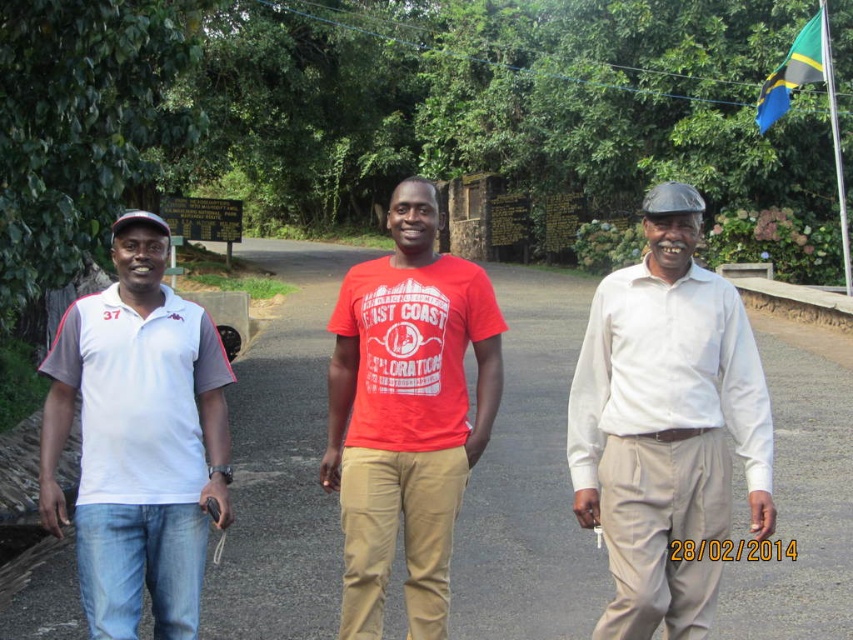
Consider the image. Is the position of khaki cotton pants at right less distant than that of matte khaki pants at center?

Yes, it is.

Who is more distant from viewer, (x=608, y=442) or (x=426, y=202)?

Positioned behind is point (x=426, y=202).

Where is `khaki cotton pants at right`? This screenshot has width=853, height=640. khaki cotton pants at right is located at coordinates (666, 424).

Does white cotton polo shirt at left appear under matte khaki pants at center?

Incorrect, white cotton polo shirt at left is not positioned below matte khaki pants at center.

Does point (148, 525) come behind point (457, 404)?

That is False.

Measure the distance between white cotton polo shirt at left and camera.

A distance of 12.28 feet exists between white cotton polo shirt at left and camera.

Identify the location of white cotton polo shirt at left. (138, 440).

Does khaki cotton pants at right have a larger size compared to white cotton polo shirt at left?

Yes.

You are a GUI agent. You are given a task and a screenshot of the screen. Output one action in this format:
    pyautogui.click(x=<x>, y=<y>)
    Task: Click on the khaki cotton pants at right
    The width and height of the screenshot is (853, 640).
    Given the screenshot: What is the action you would take?
    pyautogui.click(x=666, y=424)